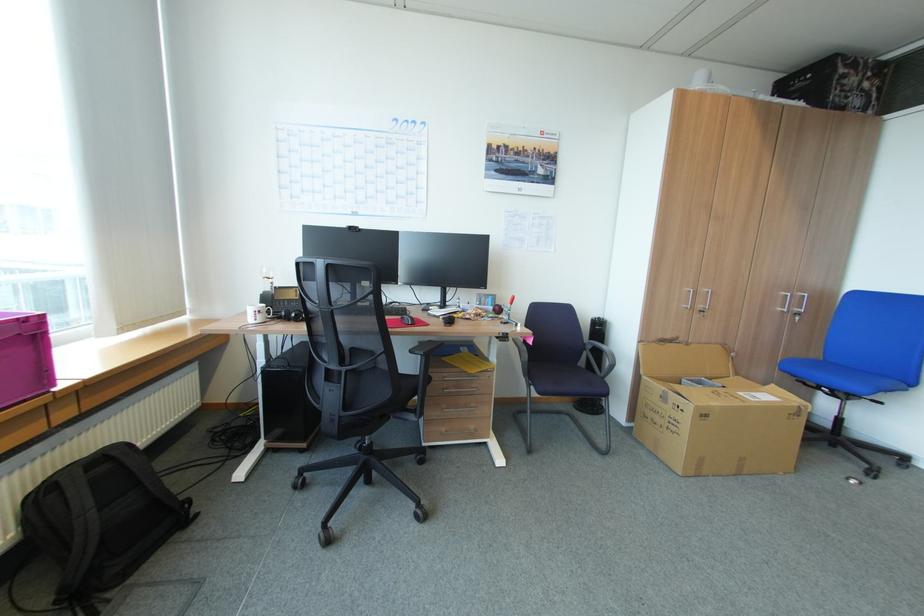
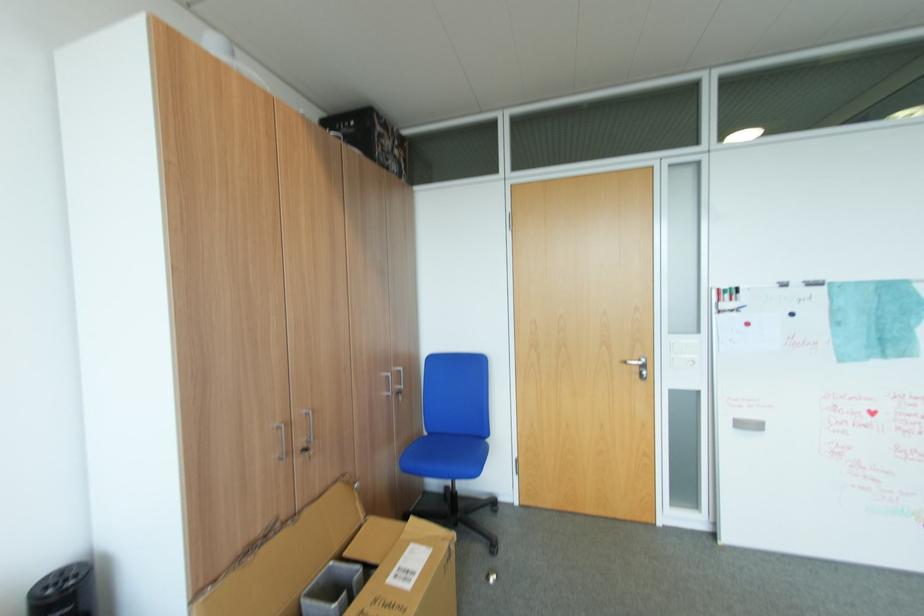
The point at (694, 379) is marked in the first image. Where is the corresponding point in the second image?

(317, 593)